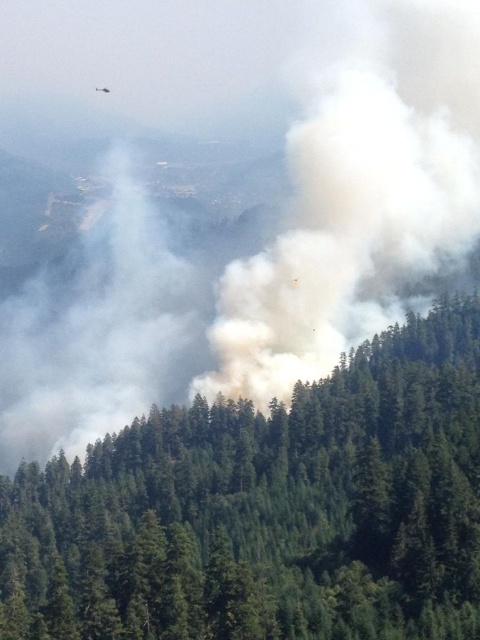
Is point (349, 365) farther from camera compared to point (336, 104)?

That is False.

How much distance is there between green textured trees at center and white fluffy smoke at center?

The distance of green textured trees at center from white fluffy smoke at center is 63.19 meters.

Where is `green textured trees at center`? green textured trees at center is located at coordinates (267, 509).